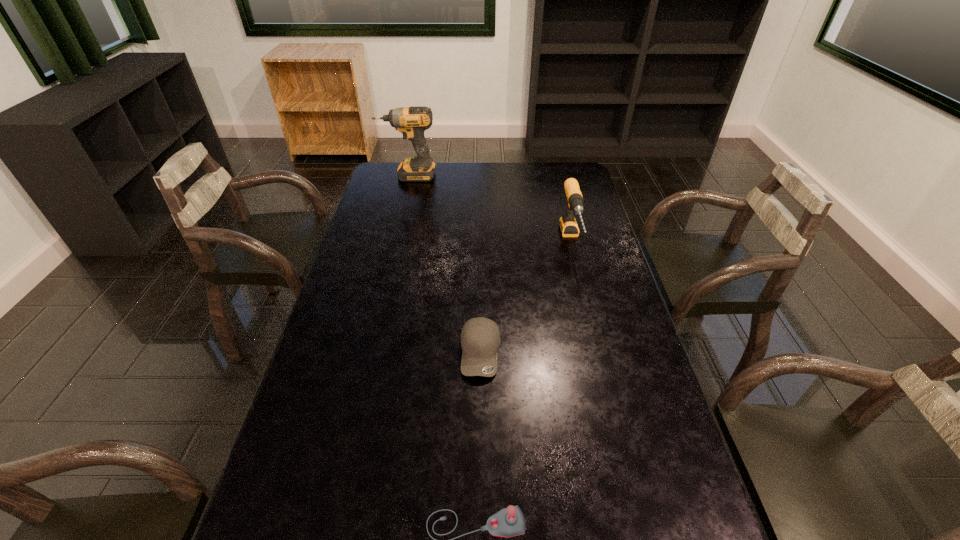
You are a GUI agent. You are given a task and a screenshot of the screen. Output one action in this format:
    pyautogui.click(x=<x>, y=<y>)
    Task: Click on the left drill
    
    Given the screenshot: What is the action you would take?
    [411, 121]

Locate an element on the screen. The height and width of the screenshot is (540, 960). the leftmost object is located at coordinates (411, 121).

Identify the location of the nearer drill. (568, 225).

I want to click on the rightmost object, so click(x=568, y=225).

At what (x,y) coordinates should I click in order to perform the action: click on baseball cap. Please return your answer as a coordinate pair (x, y). This screenshot has height=540, width=960. Looking at the image, I should click on (480, 337).

Image resolution: width=960 pixels, height=540 pixels. I want to click on free spot located on the handle side of the shorter drill, so click(594, 330).

Locate an element on the screen. The width and height of the screenshot is (960, 540). free space located on the front brim of the second nearest object is located at coordinates (481, 412).

At what (x,y) coordinates should I click in order to perform the action: click on object that is at the far edge. Please return your answer as a coordinate pair (x, y). Image resolution: width=960 pixels, height=540 pixels. Looking at the image, I should click on [411, 121].

At what (x,y) coordinates should I click in order to perform the action: click on object present at the left edge. Please return your answer as a coordinate pair (x, y). The image size is (960, 540). Looking at the image, I should click on (411, 121).

At what (x,y) coordinates should I click in order to perform the action: click on object that is at the right edge. Please return your answer as a coordinate pair (x, y). Looking at the image, I should click on (568, 225).